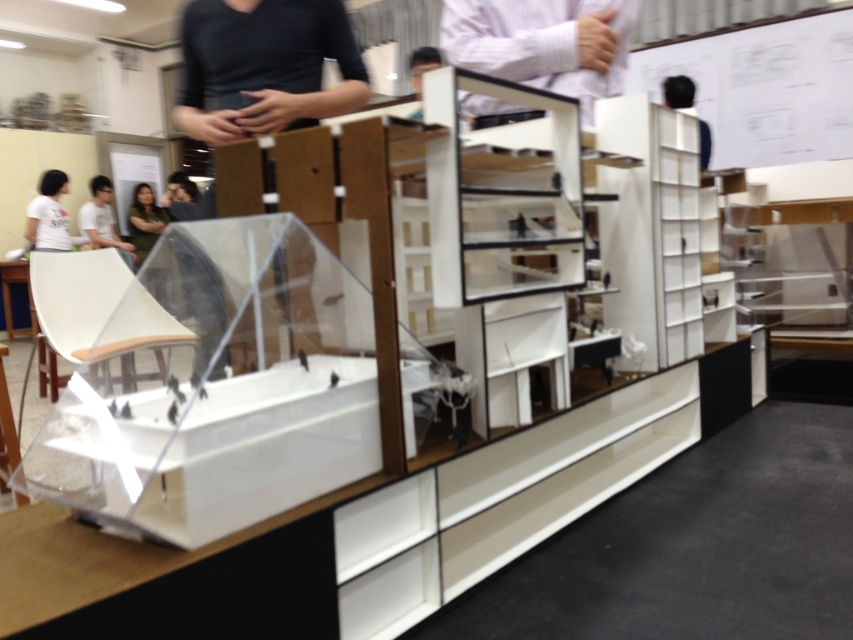
You are an observer in the classroom. You notice two items in the scene described as the white striped shirt at upper center and the black fabric at upper right. Which of these two items appears wider from your perspective?

The white striped shirt at upper center appears wider than the black fabric at upper right because its width is larger according to the description.

You are an observer in the classroom and see the white striped shirt at upper center and the matte black shirt at left. Which shirt is closer to you?

The white striped shirt at upper center is closer to you because it is positioned over the matte black shirt at left, indicating it is in front.